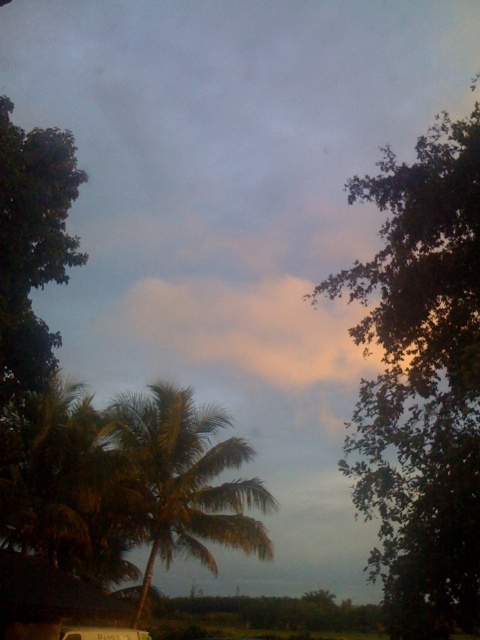
Question: Which of these objects is positioned closest to the green leafy tree at upper right?

Choices:
 (A) green leafy tree at left
 (B) metallic silver van at lower center

Answer: (A)

Question: Can you confirm if green leafy tree at upper right is positioned above green leafy palm tree at center?

Choices:
 (A) yes
 (B) no

Answer: (A)

Question: Which point is closer to the camera?

Choices:
 (A) (383, 440)
 (B) (172, 444)

Answer: (A)

Question: Which object is positioned farthest from the metallic silver van at lower center?

Choices:
 (A) green leafy tree at upper right
 (B) green leafy palm tree at center

Answer: (A)

Question: Does green leafy palm tree at center appear over metallic silver van at lower center?

Choices:
 (A) yes
 (B) no

Answer: (A)

Question: Is green leafy tree at upper right positioned behind green leafy palm tree at center?

Choices:
 (A) no
 (B) yes

Answer: (A)